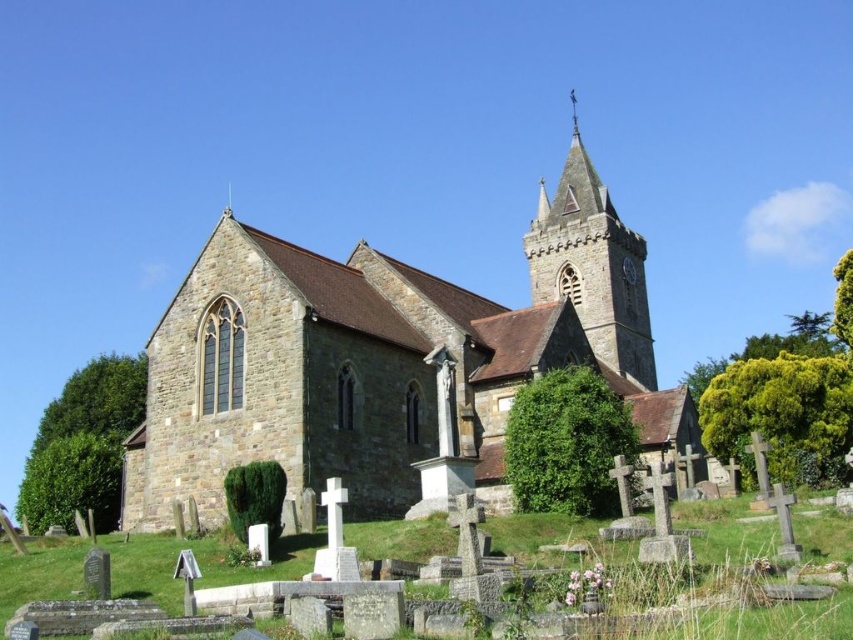
Does brown stone church at center lie in front of stone steeple at upper center?

That is True.

Can you confirm if brown stone church at center is thinner than stone steeple at upper center?

No, brown stone church at center is not thinner than stone steeple at upper center.

Between point (445, 314) and point (624, 257), which one is positioned in front?

Point (445, 314)

Where is `brown stone church at center`? The image size is (853, 640). brown stone church at center is located at coordinates point(386,360).